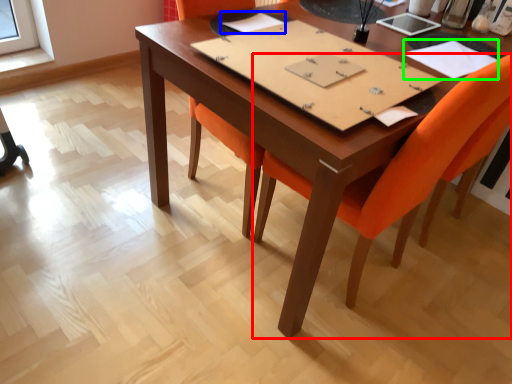
Question: Which is farther away from chair (highlighted by a red box)? notebook (highlighted by a blue box) or notebook (highlighted by a green box)?

Choices:
 (A) notebook
 (B) notebook

Answer: (A)